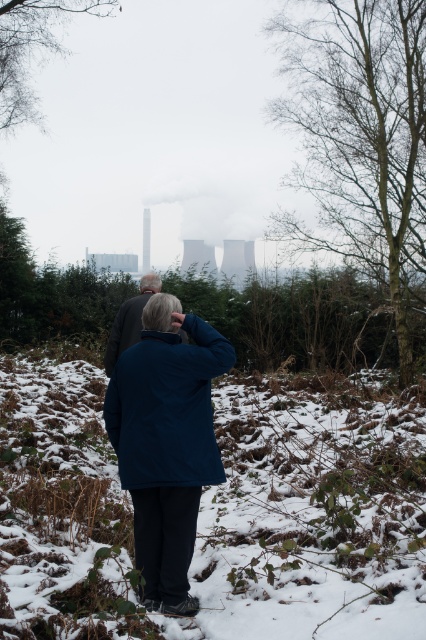
You are standing at the point marked as point (x=32, y=48) in the image. What do you see directly in front of you?

At point 0.077, there are bare branches at upper left.

You are standing at the point marked as point (218, 509) in the image. What is the terrain like at that location?

The terrain at point (218, 509) is white fluffy snow at center.

You are standing at the center of the image and want to walk towards the bare wood tree at right. Which direction should you face to head directly towards it?

Since the 2D location of the bare wood tree at right is at point [360,138], you should face towards the right and slightly downward from the center to head directly towards it.